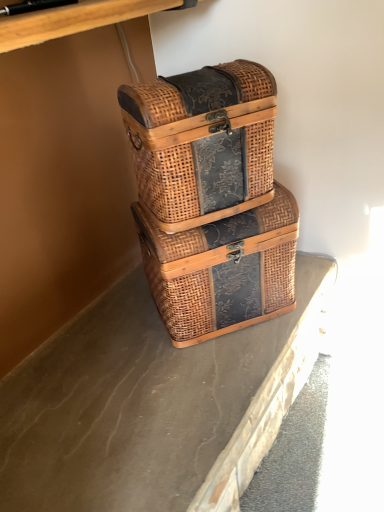
Locate an element on the screen. The image size is (384, 512). blank space situated above woven wood picnic basket at center, arranged as the first picnic basket when viewed from the top (from a real-world perspective) is located at coordinates (200, 74).